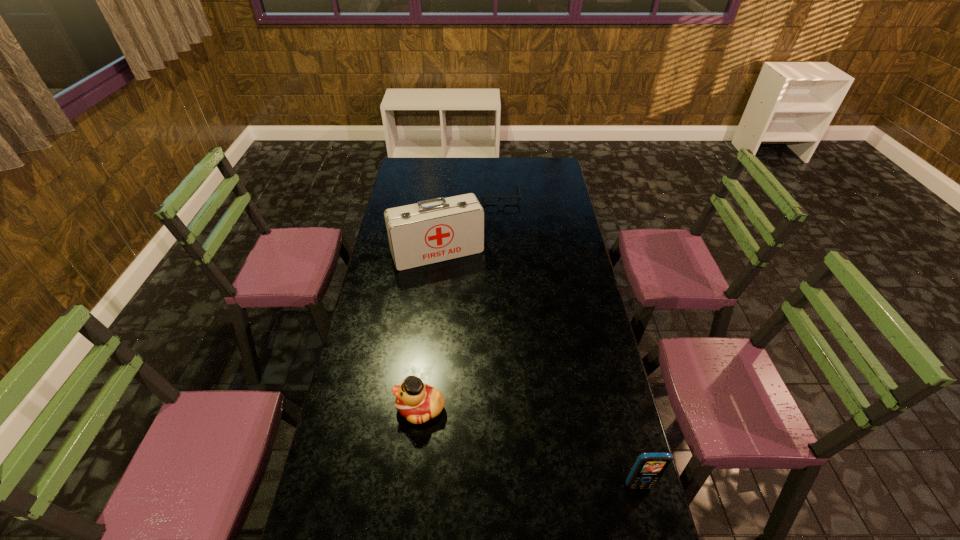
In order to click on empty space that is in between the farthest object and the rightmost object in this screenshot , I will do `click(570, 340)`.

Find the location of a particular element. blank region between the duck and the shortest object is located at coordinates (461, 301).

You are a GUI agent. You are given a task and a screenshot of the screen. Output one action in this format:
    pyautogui.click(x=<x>, y=<y>)
    Task: Click on the free spot between the shortest object and the duck
    
    Given the screenshot: What is the action you would take?
    pyautogui.click(x=461, y=301)

The width and height of the screenshot is (960, 540). Identify the location of object that can be found as the second closest to the tallest object. (418, 402).

Find the location of a particular element. the closest object to the first-aid kit is located at coordinates (483, 197).

Find the location of a particular element. The height and width of the screenshot is (540, 960). vacant region that satisfies the following two spatial constraints: 1. on the back side of the first-aid kit; 2. on the right side of the shortest object is located at coordinates (444, 195).

Image resolution: width=960 pixels, height=540 pixels. Identify the location of free spot that satisfies the following two spatial constraints: 1. on the back side of the first-aid kit; 2. on the right side of the farthest object. (444, 195).